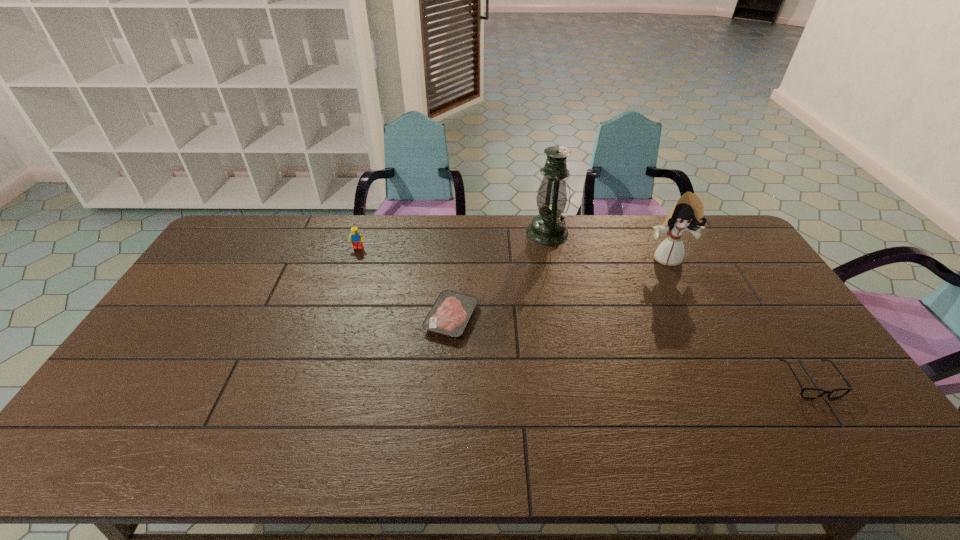
The image size is (960, 540). Identify the location of free space between the fourth shortest object and the fourth object from right to left. (559, 288).

At what (x,y) coordinates should I click in order to perform the action: click on free space between the tallest object and the nearest object. Please return your answer as a coordinate pair (x, y). This screenshot has width=960, height=540. Looking at the image, I should click on (679, 307).

The width and height of the screenshot is (960, 540). In order to click on free space between the second nearest object and the third tallest object in this screenshot , I will do `click(405, 283)`.

Identify the location of object that is the closest to the fourth farthest object. This screenshot has width=960, height=540. (548, 228).

Locate which object ranks fourth in proximity to the tallest object. Please provide its 2D coordinates. Your answer should be formatted as a tuple, i.e. [(x, y)], where the tuple contains the x and y coordinates of a point satisfying the conditions above.

[(810, 393)]

I want to click on vacant space that satisfies the following two spatial constraints: 1. on the front-facing side of the leftmost object; 2. on the right side of the fourth farthest object, so click(335, 318).